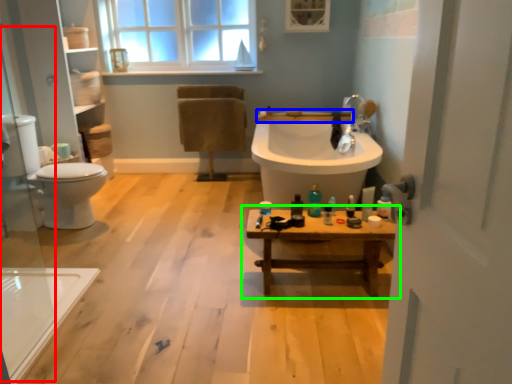
Question: Based on their relative distances, which object is farther from glass door (highlighted by a red box)? Choose from counter top (highlighted by a blue box) and table (highlighted by a green box).

Choices:
 (A) counter top
 (B) table

Answer: (A)